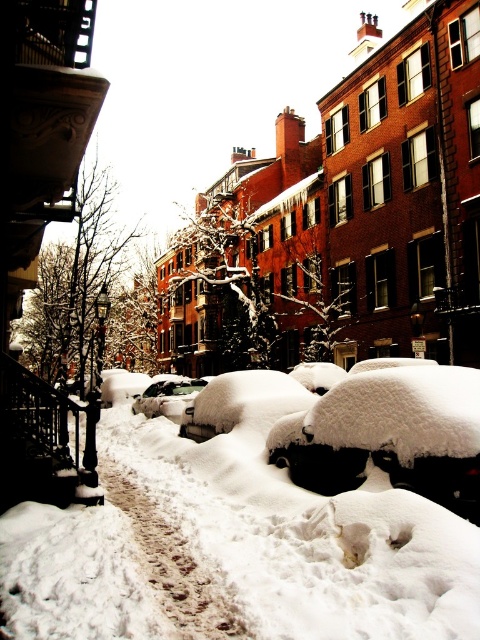
You are standing at the edge of the street in the winter scene. You see the white fluffy snow at center and the shiny silver car at center. Which object is closer to you?

The white fluffy snow at center is closer to the viewer than the shiny silver car at center.

You are a delivery person trying to reach the shiny silver car at center to drop off a package. However, there is white fluffy snow at center in your way. From the perspective of an observer standing at the starting point, which direction should you move to avoid the snow and reach the car?

The white fluffy snow at center is on the right side of the shiny silver car at center, so to avoid the snow and reach the car, you should move to the left side of the white fluffy snow at center.